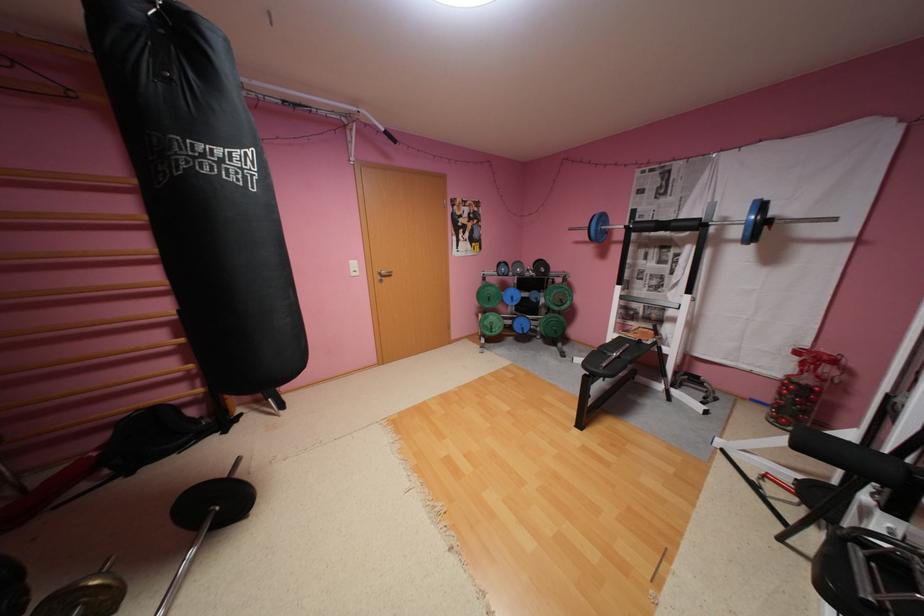
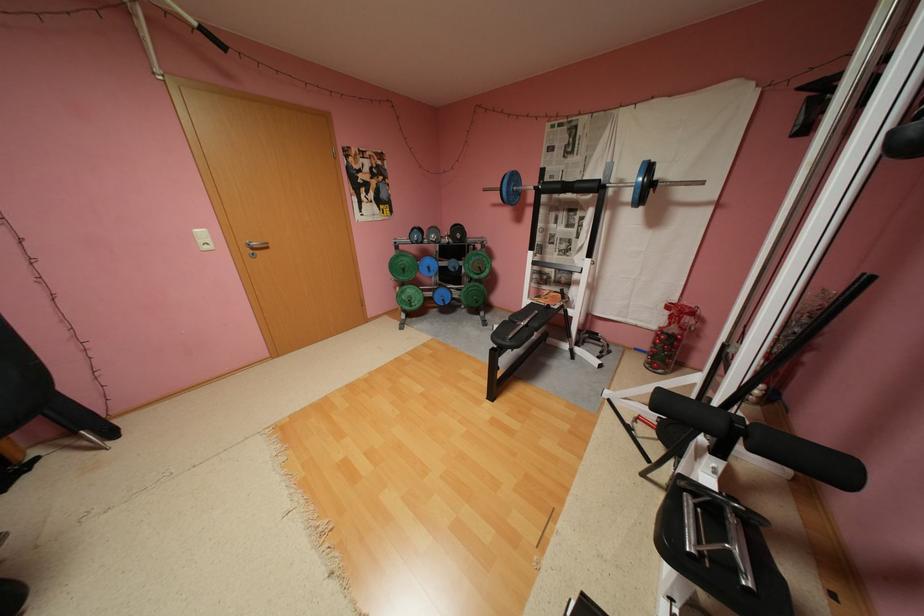
Find the pixel in the second image that matches pixel 683 224 in the first image.

(586, 185)